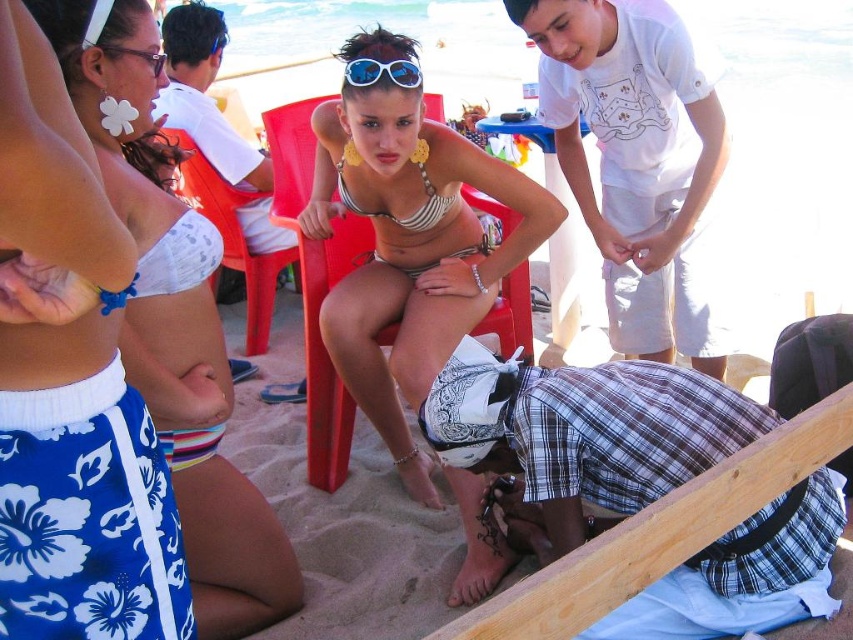
Question: Does matte silver bikini at center have a larger size compared to clear plastic goggles at upper left?

Choices:
 (A) yes
 (B) no

Answer: (A)

Question: Does matte silver bikini at center appear on the right side of white cotton shirt at upper center?

Choices:
 (A) yes
 (B) no

Answer: (B)

Question: Which object is positioned farthest from the plastic red chair at center?

Choices:
 (A) matte white bikini top at center
 (B) clear plastic goggles at upper left
 (C) matte silver bikini at center
 (D) white floral skirt at lower left

Answer: (D)

Question: Is white floral skirt at lower left thinner than clear plastic goggles at upper left?

Choices:
 (A) no
 (B) yes

Answer: (A)

Question: Which of the following is the closest to the observer?

Choices:
 (A) white floral skirt at lower left
 (B) plastic red chair at center

Answer: (A)

Question: Which of these objects is positioned farthest from the white floral skirt at lower left?

Choices:
 (A) white cotton shirt at upper left
 (B) clear plastic goggles at upper left
 (C) matte silver bikini at center

Answer: (A)